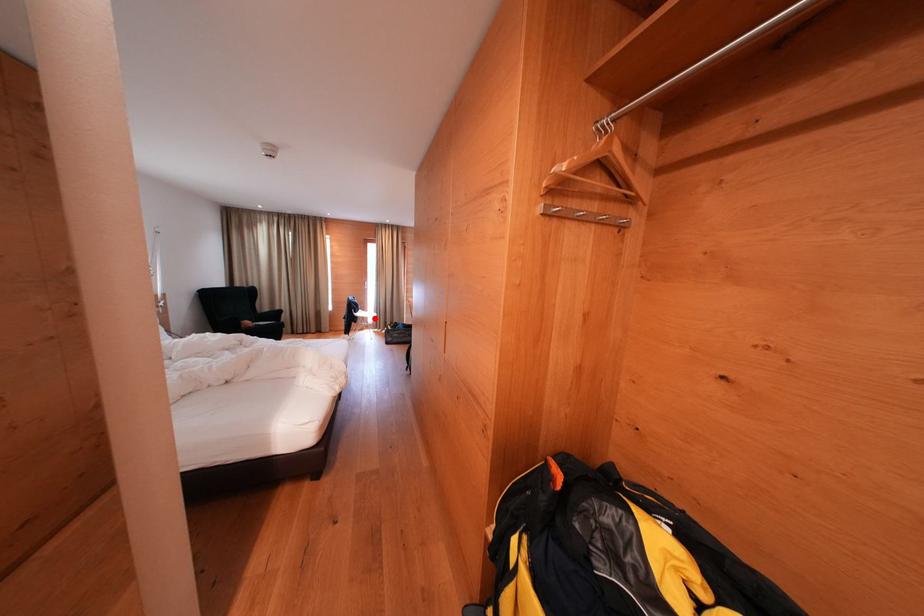
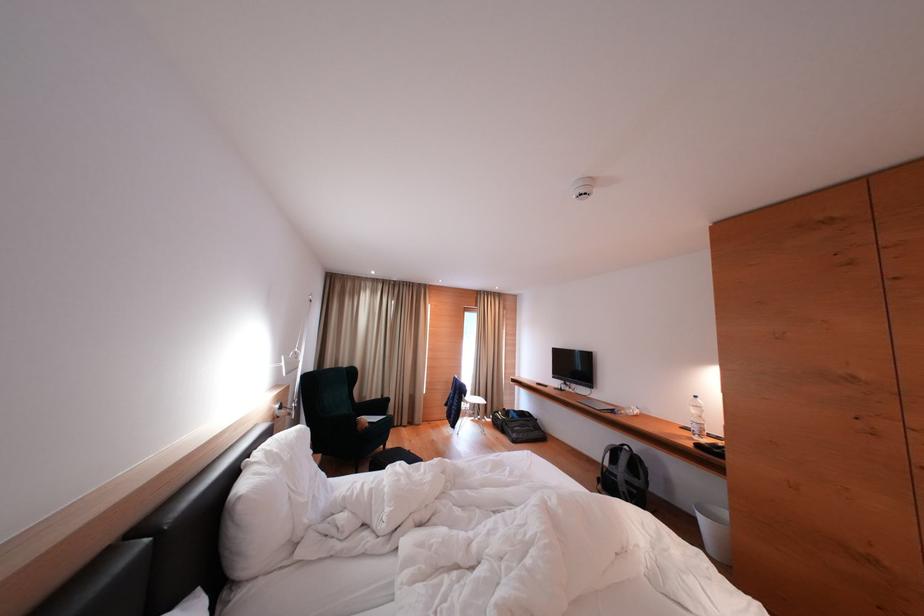
Question: I am providing you with two images of the same scene from different viewpoints. In image1, a red point is highlighted. Considering the same 3D point in image2, which of the following is correct?

Choices:
 (A) It is closer
 (B) It is farther

Answer: (B)